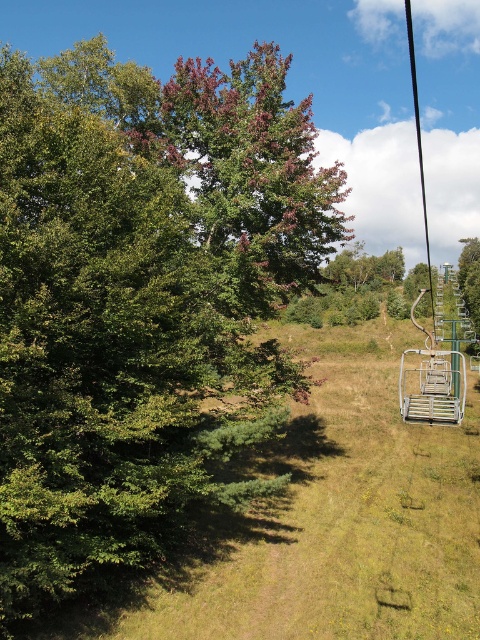
You are standing in the serene outdoor scene with the chairlift system. You notice two green leafy trees in the image. Which tree, the green leafy tree at upper left or the green leafy tree at center, is closer to you?

The green leafy tree at upper left is closer to the viewer than the green leafy tree at center.

You are standing at the base of the ski lift and want to take a photo of the metallic silver ski lift at right with the green leafy tree at upper left in the background. Is the tree positioned to the left or right side of the ski lift in the frame?

The green leafy tree at upper left is positioned to the left of the metallic silver ski lift at right in the frame.